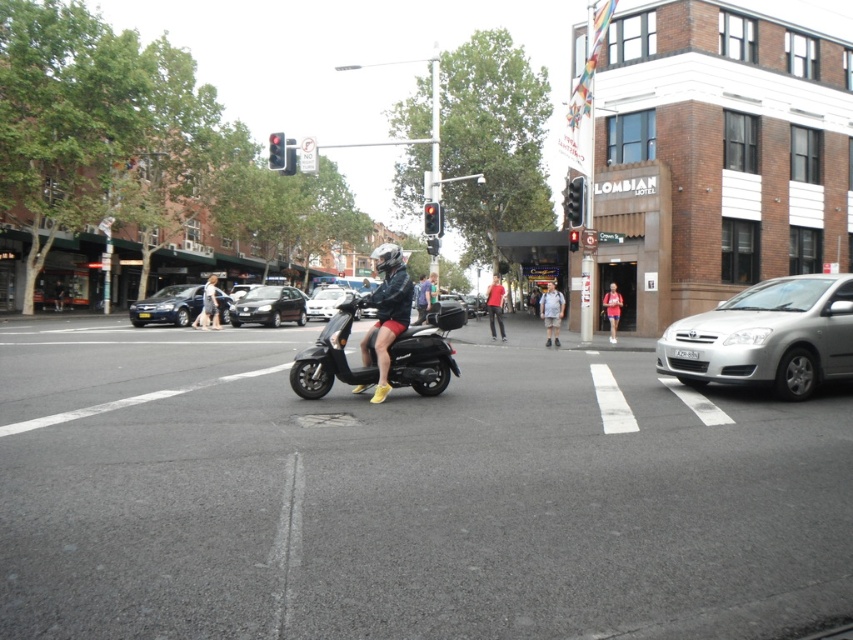
Which is in front, point (787, 289) or point (564, 202)?

Point (787, 289) is more forward.

Is the position of silver metallic sedan at right less distant than that of black plastic traffic light at upper center?

Yes.

Locate an element on the screen. Image resolution: width=853 pixels, height=640 pixels. silver metallic sedan at right is located at coordinates (766, 337).

Where is `silver metallic sedan at right`? silver metallic sedan at right is located at coordinates 766,337.

Does shiny black scooter at center appear over red cotton shirt at center?

No.

Who is lower down, shiny black scooter at center or red cotton shirt at center?

Positioned lower is shiny black scooter at center.

Who is more distant from viewer, (405, 348) or (498, 308)?

Point (498, 308)

Locate an element on the screen. shiny black scooter at center is located at coordinates (334, 355).

Is silver metallic sedan at right positioned at the back of shiny black scooter at center?

Yes, silver metallic sedan at right is behind shiny black scooter at center.

Does point (824, 305) lie behind point (352, 381)?

Yes, point (824, 305) is behind point (352, 381).

The width and height of the screenshot is (853, 640). I want to click on silver metallic sedan at right, so click(766, 337).

Locate an element on the screen. This screenshot has width=853, height=640. silver metallic sedan at right is located at coordinates (766, 337).